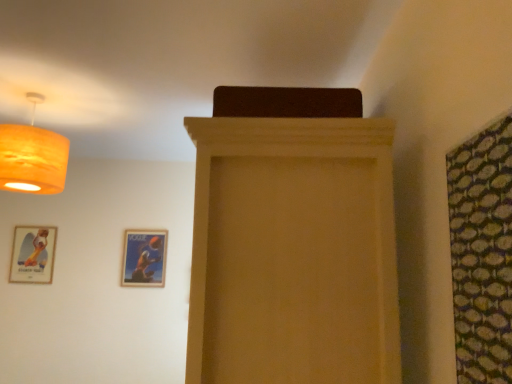
Question: Can you confirm if matte gold picture frame at lower left, the first picture frame in the left-to-right sequence, is smaller than green textured fabric at right?

Choices:
 (A) no
 (B) yes

Answer: (B)

Question: Is matte gold picture frame at lower left, the first picture frame in the left-to-right sequence, taller than green textured fabric at right?

Choices:
 (A) yes
 (B) no

Answer: (B)

Question: Is matte gold picture frame at lower left, the first picture frame in the left-to-right sequence, positioned in front of green textured fabric at right?

Choices:
 (A) yes
 (B) no

Answer: (B)

Question: Is matte gold picture frame at lower left, which is counted as the second picture frame, starting from the right, oriented away from green textured fabric at right?

Choices:
 (A) yes
 (B) no

Answer: (B)

Question: Considering the relative sizes of matte gold picture frame at lower left, which is counted as the second picture frame, starting from the right, and green textured fabric at right in the image provided, is matte gold picture frame at lower left, which is counted as the second picture frame, starting from the right, bigger than green textured fabric at right?

Choices:
 (A) no
 (B) yes

Answer: (A)

Question: Based on their positions, is wooden glossy picture frame at lower center, acting as the second picture frame starting from the left, located to the left or right of green textured fabric at right?

Choices:
 (A) right
 (B) left

Answer: (B)

Question: Looking at their shapes, would you say wooden glossy picture frame at lower center, marked as the 1th picture frame in a right-to-left arrangement, is wider or thinner than green textured fabric at right?

Choices:
 (A) wide
 (B) thin

Answer: (B)

Question: Is point (130, 264) positioned closer to the camera than point (473, 221)?

Choices:
 (A) closer
 (B) farther

Answer: (B)

Question: Do you think wooden glossy picture frame at lower center, acting as the second picture frame starting from the left, is within green textured fabric at right, or outside of it?

Choices:
 (A) outside
 (B) inside

Answer: (A)

Question: In the image, is wooden glossy picture frame at lower center, marked as the 1th picture frame in a right-to-left arrangement, on the left side or the right side of matte orange lampshade at upper left?

Choices:
 (A) right
 (B) left

Answer: (A)

Question: Considering their positions, is wooden glossy picture frame at lower center, acting as the second picture frame starting from the left, located in front of or behind matte orange lampshade at upper left?

Choices:
 (A) front
 (B) behind

Answer: (B)

Question: Choose the correct answer: Is wooden glossy picture frame at lower center, acting as the second picture frame starting from the left, inside matte orange lampshade at upper left or outside it?

Choices:
 (A) inside
 (B) outside

Answer: (B)

Question: From a real-world perspective, is wooden glossy picture frame at lower center, acting as the second picture frame starting from the left, positioned above or below matte orange lampshade at upper left?

Choices:
 (A) below
 (B) above

Answer: (A)

Question: In terms of size, does green textured fabric at right appear bigger or smaller than matte wood cabinet at center?

Choices:
 (A) small
 (B) big

Answer: (A)

Question: From their relative heights in the image, would you say green textured fabric at right is taller or shorter than matte wood cabinet at center?

Choices:
 (A) short
 (B) tall

Answer: (A)